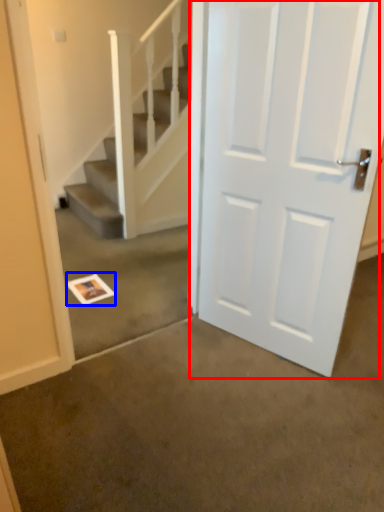
Question: Which of the following is the closest to the observer, door (highlighted by a red box) or postcard (highlighted by a blue box)?

Choices:
 (A) door
 (B) postcard

Answer: (A)